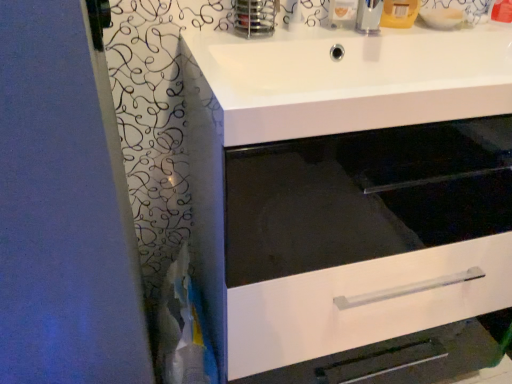
Question: Does white glossy drawer at center have a smaller size compared to white glossy sink at upper center?

Choices:
 (A) yes
 (B) no

Answer: (B)

Question: Considering the relative sizes of white glossy drawer at center and white glossy sink at upper center in the image provided, is white glossy drawer at center wider than white glossy sink at upper center?

Choices:
 (A) yes
 (B) no

Answer: (B)

Question: Could you tell me if white glossy drawer at center is turned towards white glossy sink at upper center?

Choices:
 (A) no
 (B) yes

Answer: (A)

Question: Considering the relative sizes of white glossy drawer at center and white glossy sink at upper center in the image provided, is white glossy drawer at center thinner than white glossy sink at upper center?

Choices:
 (A) yes
 (B) no

Answer: (A)

Question: From the image's perspective, is white glossy drawer at center under white glossy sink at upper center?

Choices:
 (A) yes
 (B) no

Answer: (A)

Question: Considering the relative sizes of white glossy drawer at center and white glossy sink at upper center in the image provided, is white glossy drawer at center bigger than white glossy sink at upper center?

Choices:
 (A) no
 (B) yes

Answer: (B)

Question: Could you tell me if white glossy sink at upper center is facing white glossy drawer at center?

Choices:
 (A) no
 (B) yes

Answer: (A)

Question: Is white glossy sink at upper center shorter than white glossy drawer at center?

Choices:
 (A) yes
 (B) no

Answer: (A)

Question: Is white glossy sink at upper center beside white glossy drawer at center?

Choices:
 (A) no
 (B) yes

Answer: (A)

Question: Is white glossy sink at upper center to the right of white glossy drawer at center from the viewer's perspective?

Choices:
 (A) no
 (B) yes

Answer: (B)

Question: Does white glossy sink at upper center have a larger size compared to white glossy drawer at center?

Choices:
 (A) no
 (B) yes

Answer: (A)

Question: Is white glossy sink at upper center smaller than white glossy drawer at center?

Choices:
 (A) yes
 (B) no

Answer: (A)

Question: From the image's perspective, is white glossy drawer at center positioned above or below white glossy sink at upper center?

Choices:
 (A) above
 (B) below

Answer: (B)